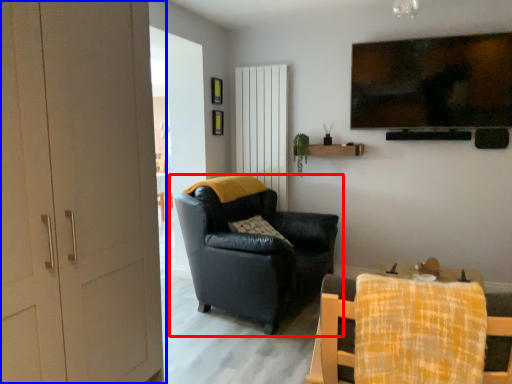
Question: Which object appears closest to the camera in this image, chair (highlighted by a red box) or door (highlighted by a blue box)?

Choices:
 (A) chair
 (B) door

Answer: (B)